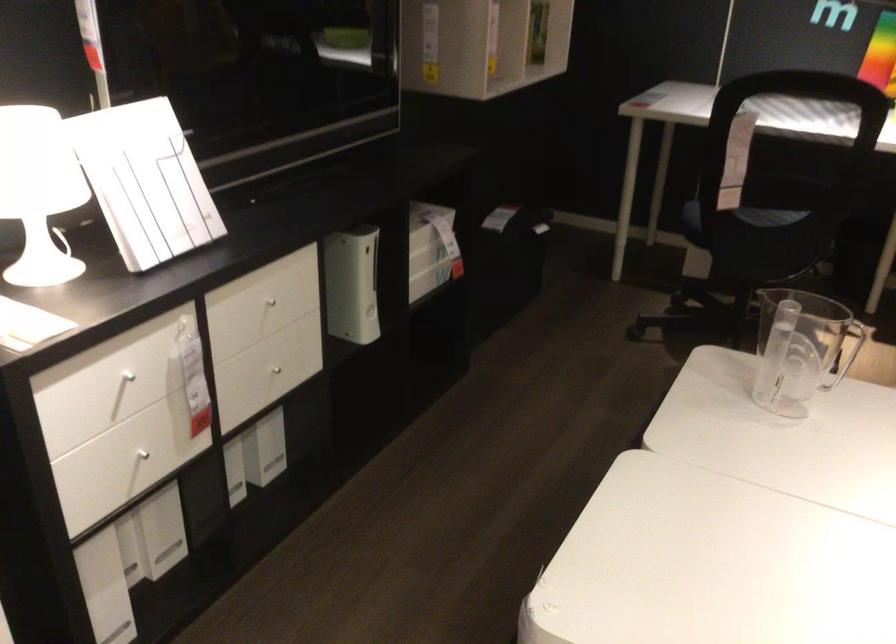
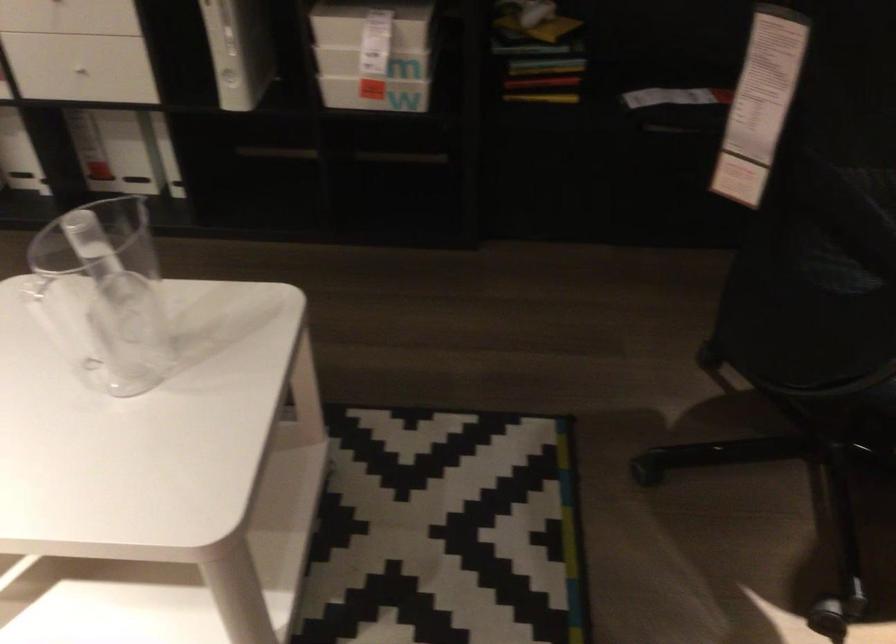
The point at (434, 285) is marked in the first image. Where is the corresponding point in the second image?

(375, 93)